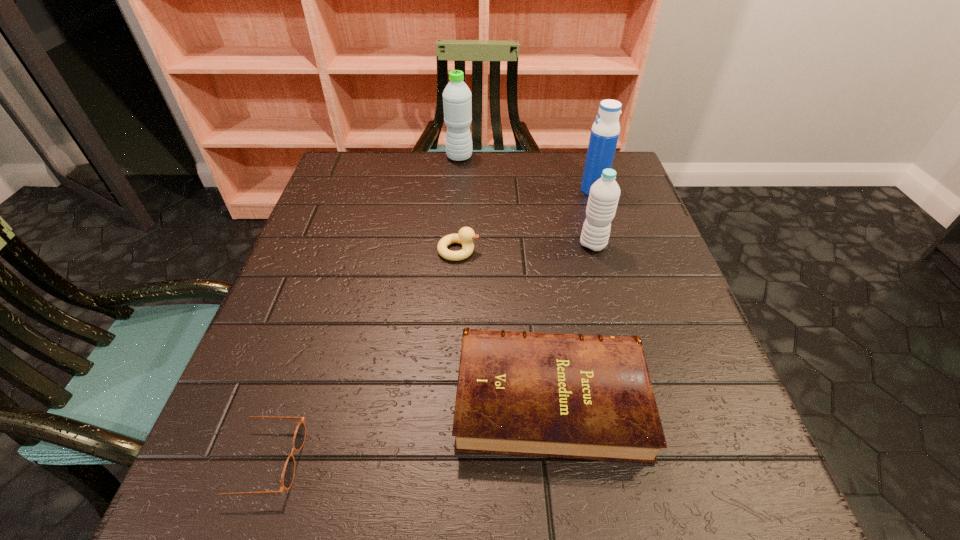
Locate an element on the screen. This screenshot has height=540, width=960. free region located 0.350m on the front of the second farthest water bottle is located at coordinates (628, 300).

You are a GUI agent. You are given a task and a screenshot of the screen. Output one action in this format:
    pyautogui.click(x=<x>, y=<y>)
    Task: Click on the free space located on the front of the nearest water bottle
    This screenshot has height=540, width=960.
    Given the screenshot: What is the action you would take?
    pyautogui.click(x=605, y=287)

Image resolution: width=960 pixels, height=540 pixels. I want to click on vacant space located 0.380m at the beak of the duckling, so click(x=651, y=251).

The image size is (960, 540). What are the coordinates of `blank space located 0.210m on the left of the hardback book` in the screenshot? It's located at (327, 397).

This screenshot has width=960, height=540. Identify the location of blank space located on the front-facing side of the shortest object. (571, 461).

You are a GUI agent. You are given a task and a screenshot of the screen. Output one action in this format:
    pyautogui.click(x=<x>, y=<y>)
    Task: Click on the hardback book located at the near edge
    The width and height of the screenshot is (960, 540).
    Given the screenshot: What is the action you would take?
    pyautogui.click(x=590, y=397)

Where is `sunglasses at the near edge`? sunglasses at the near edge is located at coordinates (288, 473).

Find the location of a particular element. The height and width of the screenshot is (540, 960). object that is at the left edge is located at coordinates (288, 473).

At what (x,y) coordinates should I click in order to perform the action: click on hardback book situated at the right edge. Please return your answer as a coordinate pair (x, y). Looking at the image, I should click on (590, 397).

You are a GUI agent. You are given a task and a screenshot of the screen. Output one action in this format:
    pyautogui.click(x=<x>, y=<y>)
    Task: Click on the object situated at the near left corner
    Image resolution: width=960 pixels, height=540 pixels.
    Given the screenshot: What is the action you would take?
    pyautogui.click(x=288, y=473)